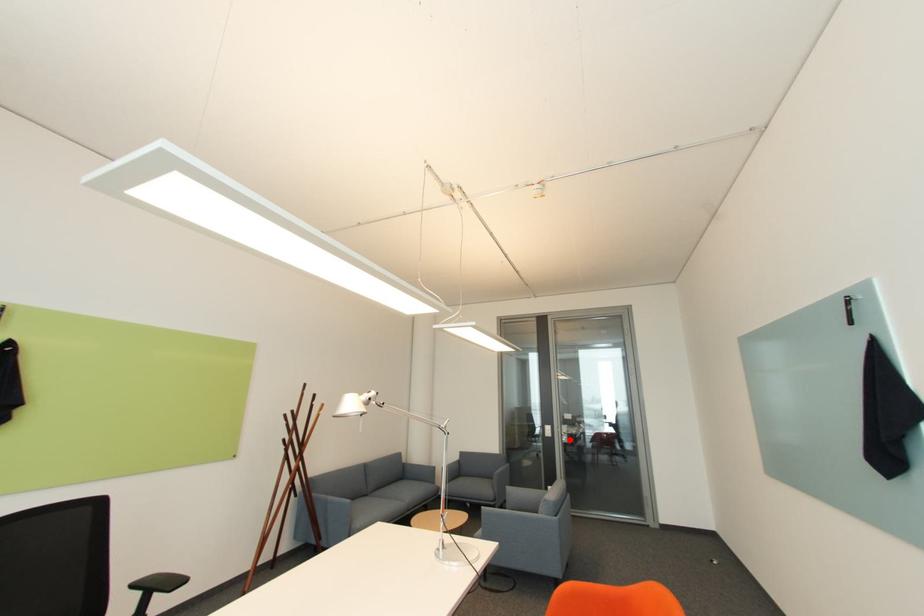
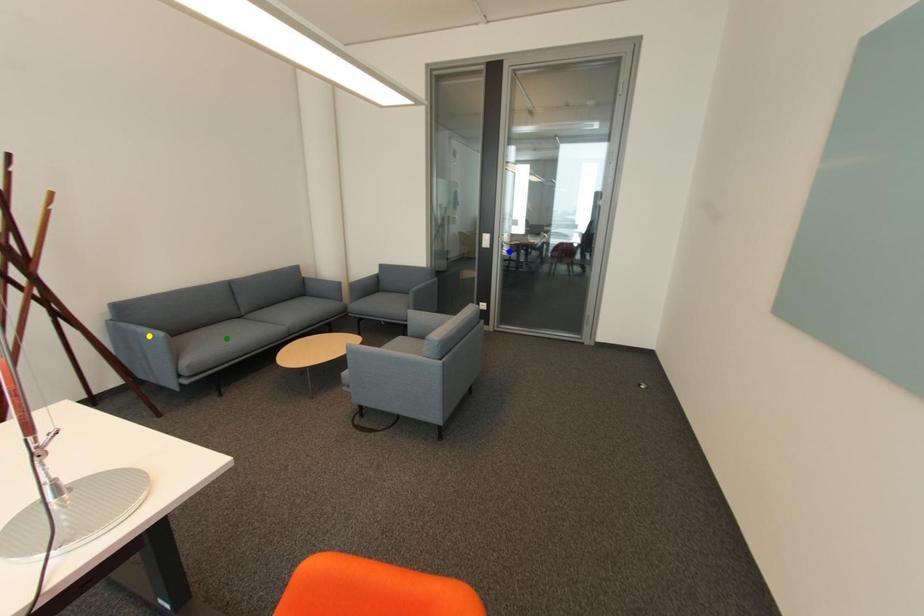
Question: I am providing you with two images of the same scene from different viewpoints. A red point is marked on the first image. You are given multiple points on the second image. In image 2, which mark is for the same physical point as the one in image 1?

Choices:
 (A) yellow point
 (B) blue point
 (C) green point

Answer: (B)